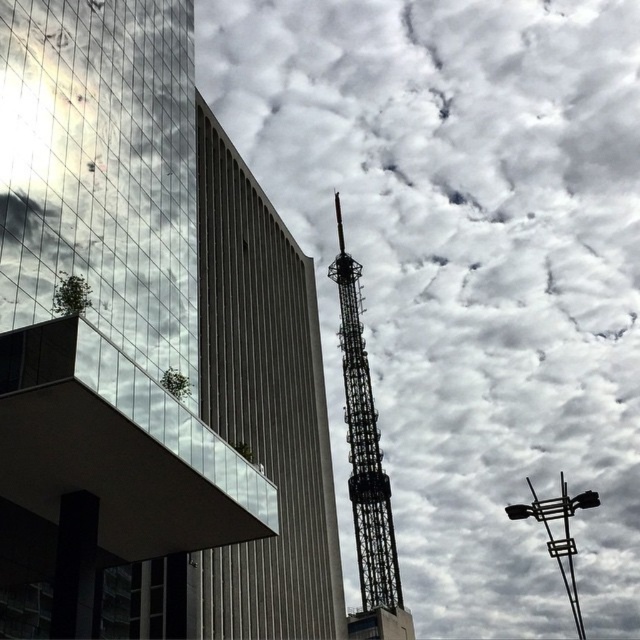
Can you confirm if metallic lattice tower at upper center is wider than metallic lattice tower at center?

Indeed, metallic lattice tower at upper center has a greater width compared to metallic lattice tower at center.

Can you confirm if metallic lattice tower at upper center is positioned to the right of metallic lattice tower at center?

Incorrect, metallic lattice tower at upper center is not on the right side of metallic lattice tower at center.

I want to click on metallic lattice tower at upper center, so click(x=104, y=292).

Find the location of `metallic lattice tower at upper center`. metallic lattice tower at upper center is located at coordinates click(x=104, y=292).

Is cloudy sky at upper center above metallic lattice tower at upper center?

Actually, cloudy sky at upper center is below metallic lattice tower at upper center.

Locate an element on the screen. The height and width of the screenshot is (640, 640). cloudy sky at upper center is located at coordinates (465, 273).

Who is more distant from viewer, (593, 164) or (257, 476)?

Point (593, 164)

The image size is (640, 640). I want to click on cloudy sky at upper center, so click(x=465, y=273).

Between cloudy sky at upper center and metallic lattice tower at center, which one is positioned higher?

cloudy sky at upper center is higher up.

Between point (337, 342) and point (369, 509), which one is positioned in front?

Positioned in front is point (369, 509).

Describe the element at coordinates (465, 273) in the screenshot. I see `cloudy sky at upper center` at that location.

The width and height of the screenshot is (640, 640). Find the location of `cloudy sky at upper center`. cloudy sky at upper center is located at coordinates (465, 273).